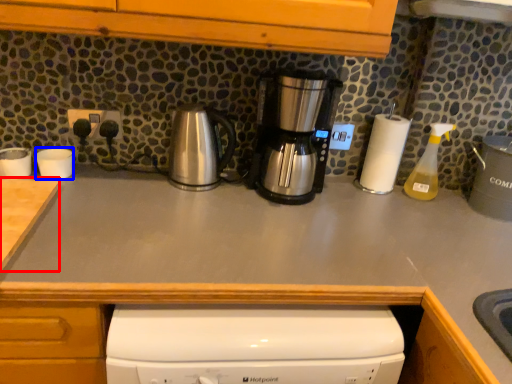
Question: Among these objects, which one is farthest to the camera, counter top (highlighted by a red box) or appliance (highlighted by a blue box)?

Choices:
 (A) counter top
 (B) appliance

Answer: (B)